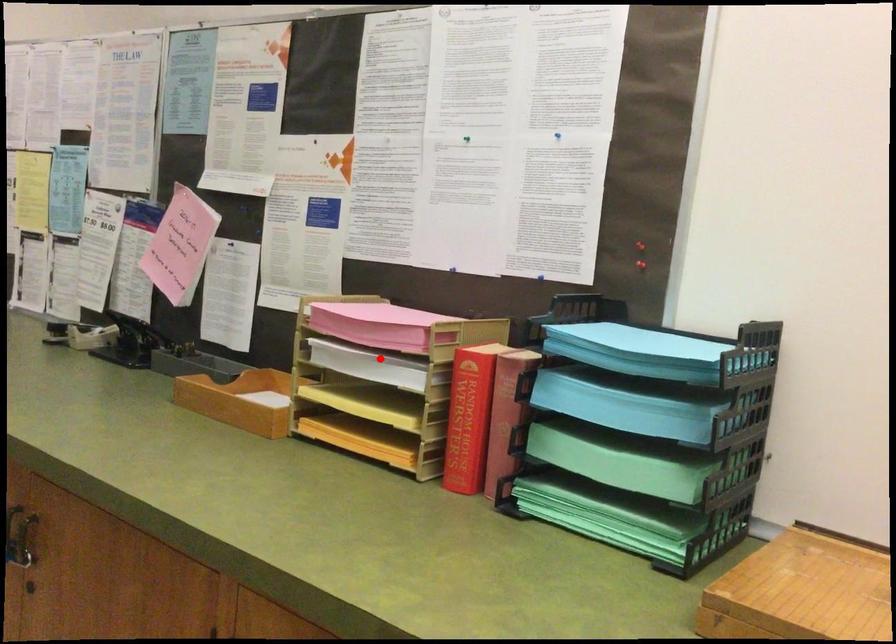
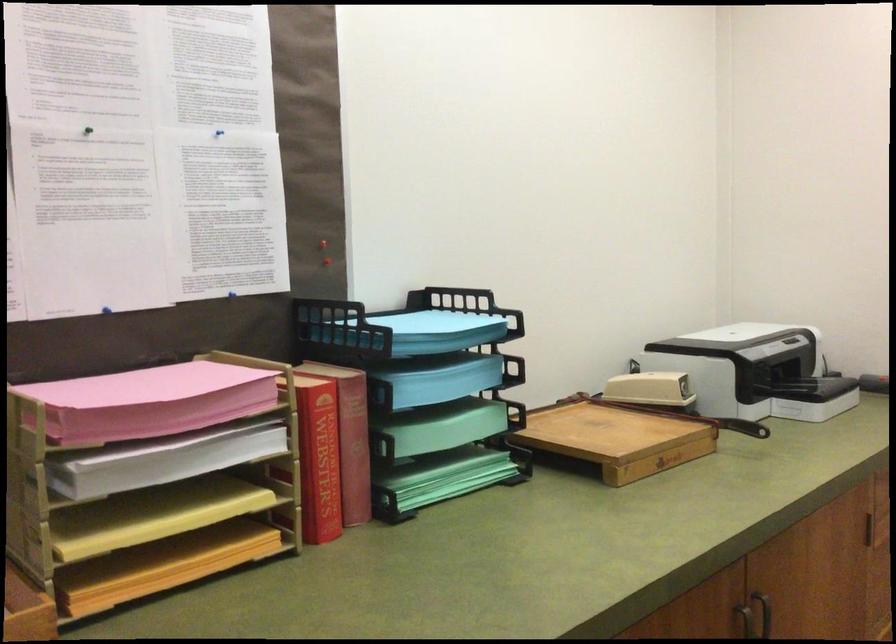
Locate, in the second image, the point that corresponds to the highlighted location in the first image.

(179, 450)